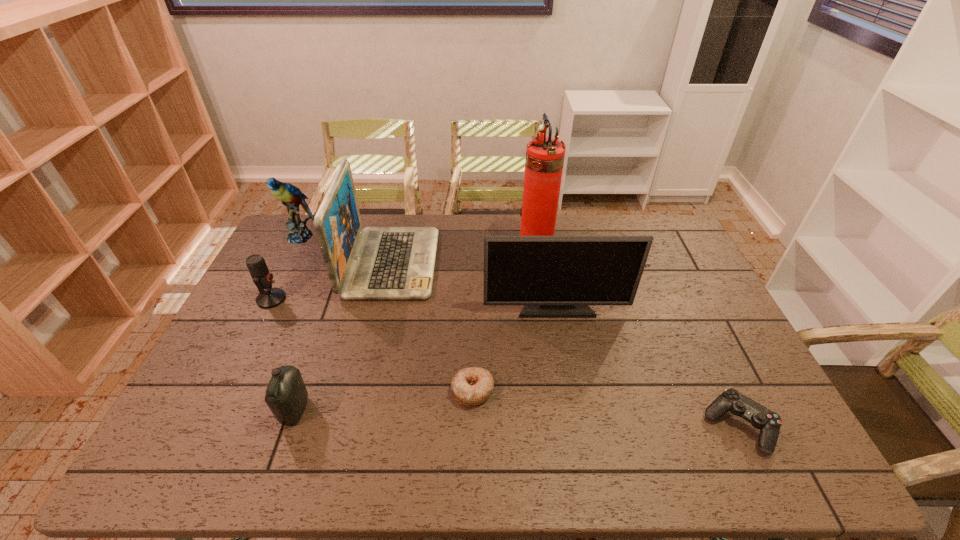
Locate an element on the screen. The width and height of the screenshot is (960, 540). vacant space at the left edge of the desktop is located at coordinates (249, 306).

The image size is (960, 540). I want to click on vacant region at the near left corner, so [x=197, y=455].

Locate an element on the screen. vacant position at the far right corner of the desktop is located at coordinates (631, 220).

The height and width of the screenshot is (540, 960). I want to click on vacant space in between the parrot and the bottle, so click(x=298, y=323).

The width and height of the screenshot is (960, 540). Find the location of `vacant point located between the fire extinguisher and the bottle`. vacant point located between the fire extinguisher and the bottle is located at coordinates (416, 329).

The image size is (960, 540). What are the coordinates of `free space between the laptop computer and the bottle` in the screenshot? It's located at (343, 337).

Identify the location of vacant space that's between the laptop computer and the bottle. Image resolution: width=960 pixels, height=540 pixels. (343, 337).

Find the location of a particular element. The width and height of the screenshot is (960, 540). vacant area that lies between the control and the parrot is located at coordinates (520, 332).

Find the location of a particular element. The width and height of the screenshot is (960, 540). free space between the laptop computer and the tallest object is located at coordinates (464, 256).

This screenshot has height=540, width=960. I want to click on vacant area that lies between the rightmost object and the tallest object, so click(637, 338).